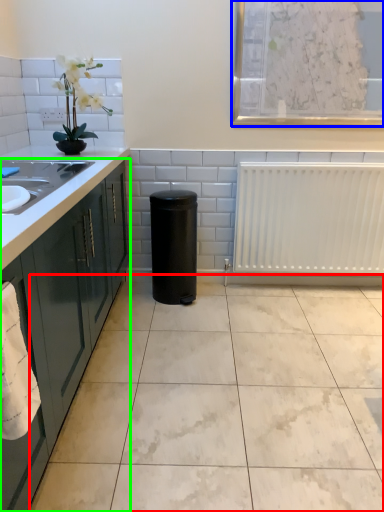
Question: Based on their relative distances, which object is nearer to ceramic tile (highlighted by a red box)? Choose from window screen (highlighted by a blue box) and cabinetry (highlighted by a green box).

Choices:
 (A) window screen
 (B) cabinetry

Answer: (B)